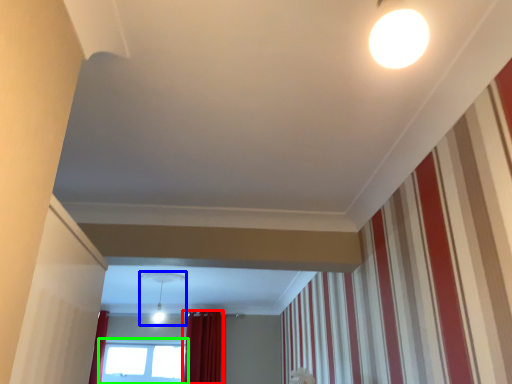
Question: Which object is the closest to the curtain (highlighted by a red box)? Choose among these: light fixture (highlighted by a blue box) or window (highlighted by a green box).

Choices:
 (A) light fixture
 (B) window

Answer: (B)